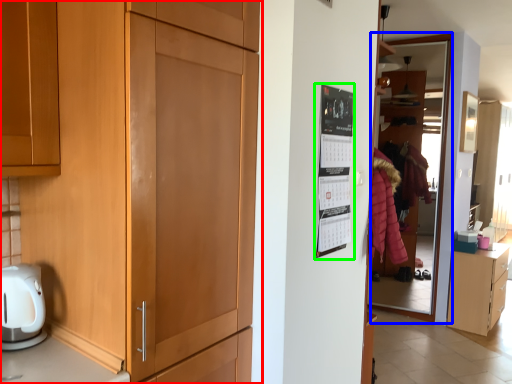
Question: Based on their relative distances, which object is farther from cupboard (highlighted by a red box)? Choose from glass door (highlighted by a blue box) and bulletin board (highlighted by a green box).

Choices:
 (A) glass door
 (B) bulletin board

Answer: (A)